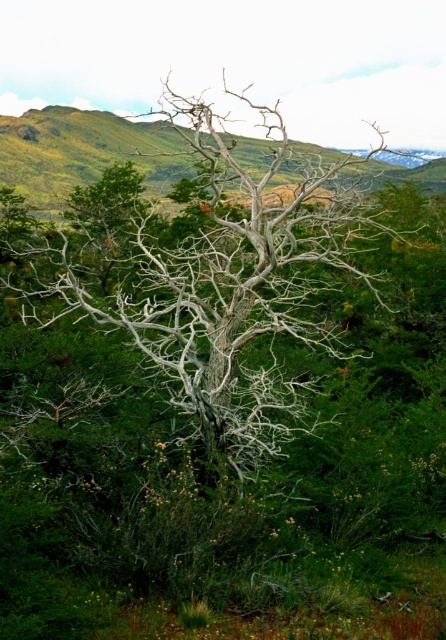
You are a photographer standing in the middle of a field. You want to capture the white bark tree at center in your shot. According to the coordinates provided, where should you position your camera to ensure the tree is centered in the frame?

To center the white bark tree at center in your shot, position your camera at the coordinates point (222, 278).

You are an artist planning to paint the scene. You want to ensure the white bark tree at center and gray bark tree at center are proportionally accurate. Which tree should you depict as taller in your painting?

The white bark tree at center should be depicted as taller than the gray bark tree at center since the description states it has a greater height.